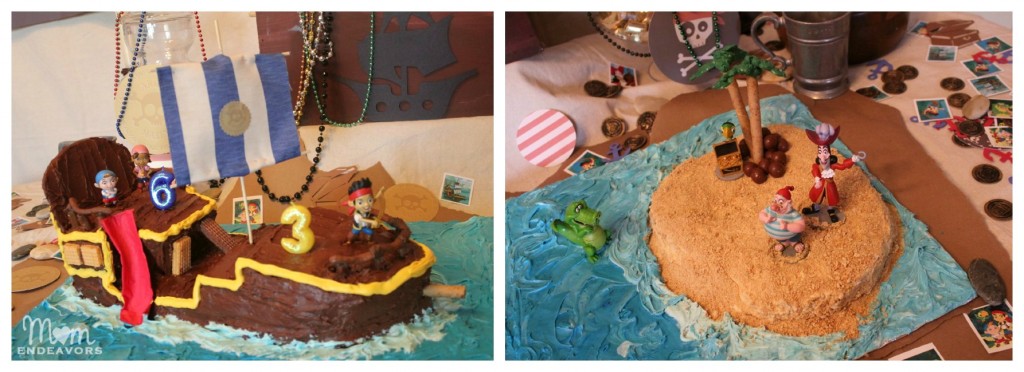
Where is `toy`? toy is located at coordinates click(x=591, y=235).